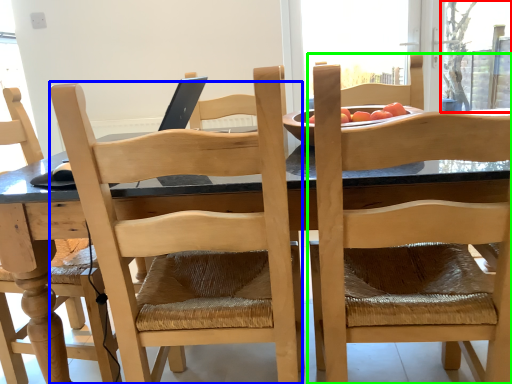
Question: Based on their relative distances, which object is farther from window screen (highlighted by a red box)? Choose from chair (highlighted by a blue box) and chair (highlighted by a green box).

Choices:
 (A) chair
 (B) chair

Answer: (A)